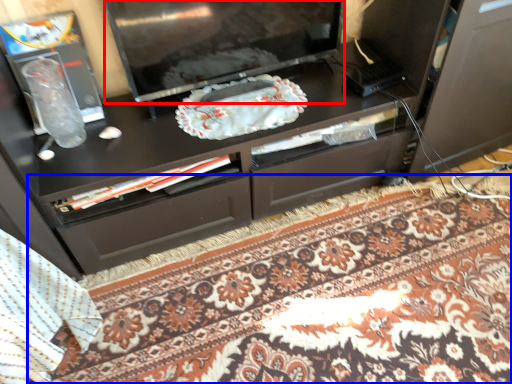
Question: Which object appears farthest to the camera in this image, television (highlighted by a red box) or mat (highlighted by a blue box)?

Choices:
 (A) television
 (B) mat

Answer: (A)